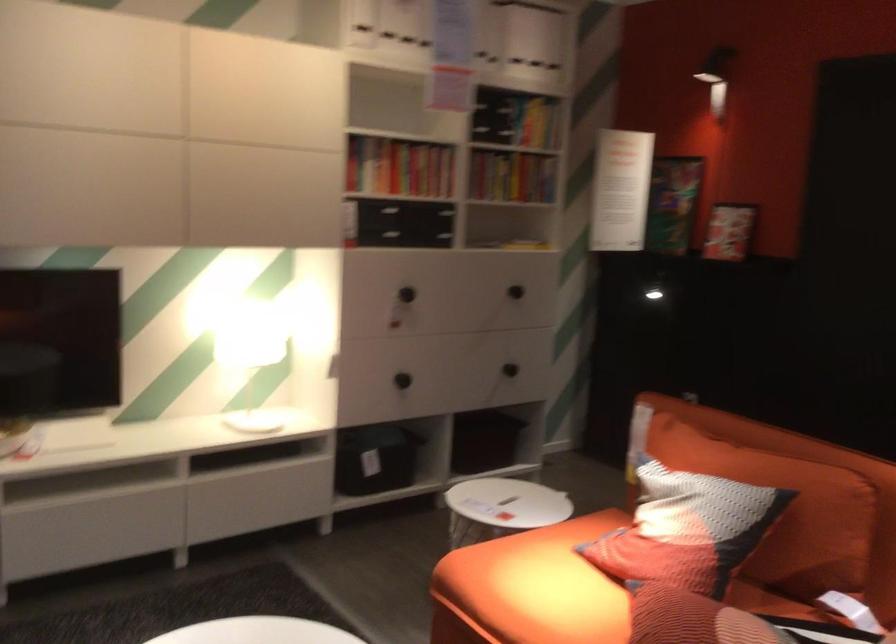
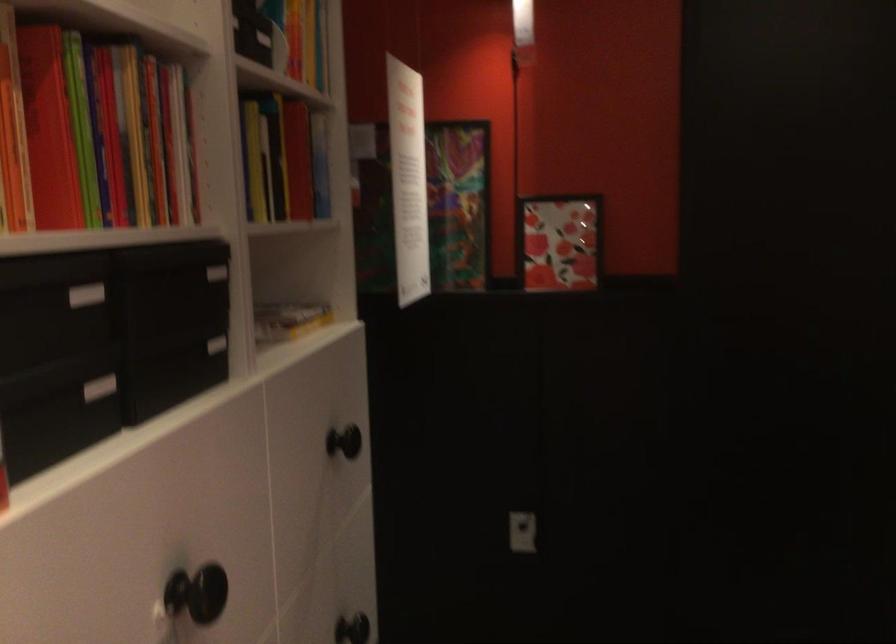
In the second image, find the point that corresponds to the point at 455,194 in the first image.

(216, 272)